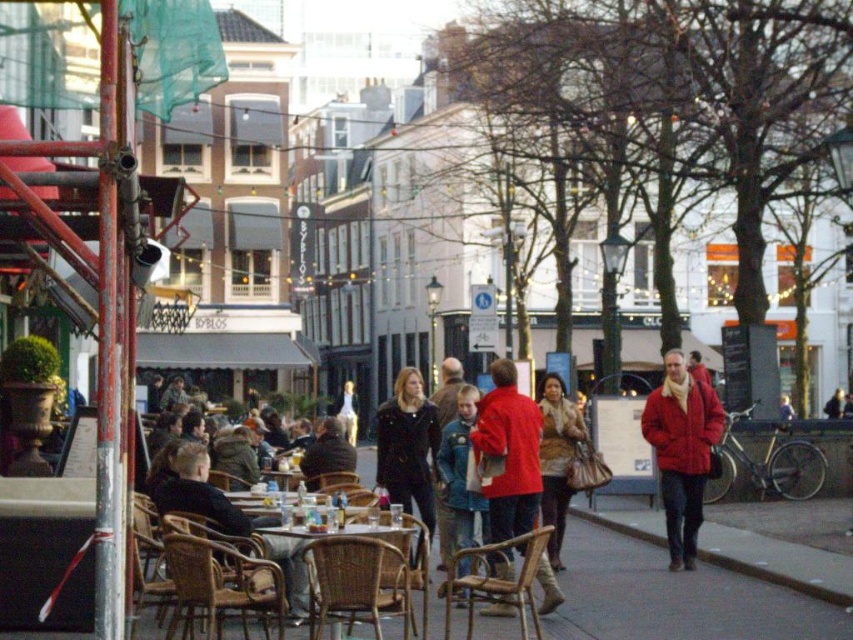
Question: Which of the following is the closest to the observer?

Choices:
 (A) (347, 422)
 (B) (340, 435)
 (C) (479, 417)
 (D) (704, 449)

Answer: (C)

Question: Which of the following is the farthest from the observer?

Choices:
 (A) brown woven chair at lower left
 (B) leather jacket at center
 (C) rattan chair at lower left

Answer: (A)

Question: Does matte black coat at center appear over woven wood chair at center?

Choices:
 (A) no
 (B) yes

Answer: (B)

Question: Does matte red jacket at center-right appear over woven wood chair at center?

Choices:
 (A) no
 (B) yes

Answer: (B)

Question: Does woven wood chair at center lie in front of dark brown leather jacket at center?

Choices:
 (A) yes
 (B) no

Answer: (A)

Question: Which point is closer to the camera?

Choices:
 (A) denim jacket at center
 (B) woven wood chair at center
 (C) matte red jacket at center-right
 (D) leather jacket at center

Answer: (B)